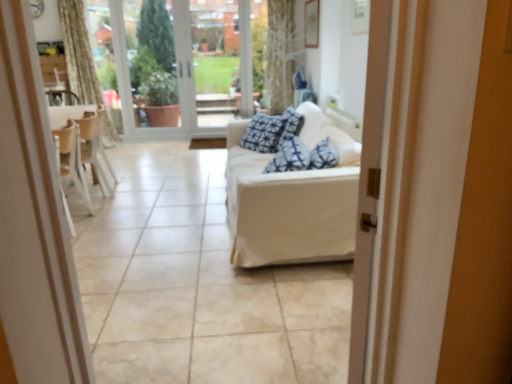
The image size is (512, 384). Identify the location of vacant space positioned to the left of white fabric couch at center. (160, 211).